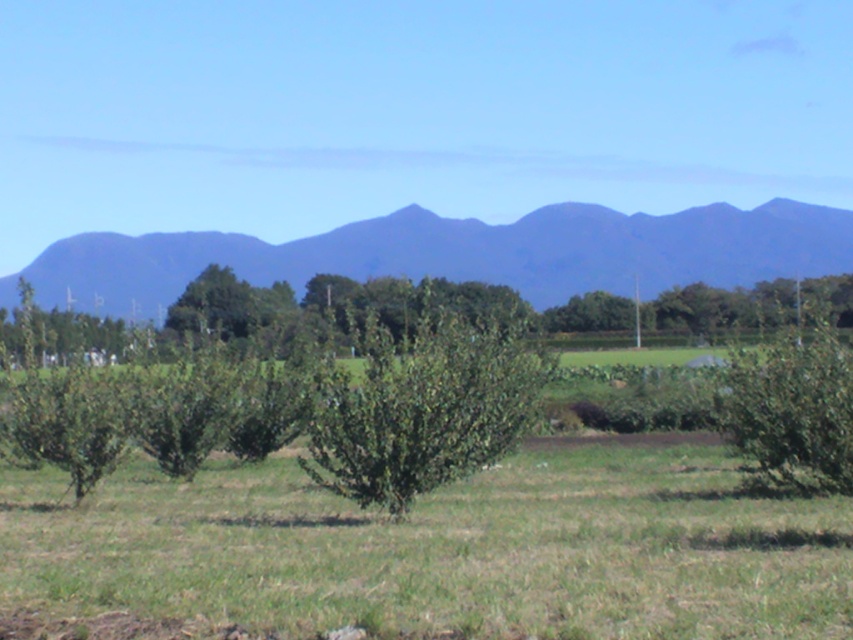
Question: Does blue matte mountain at upper center have a larger size compared to green leafy bush at center?

Choices:
 (A) no
 (B) yes

Answer: (B)

Question: Which of the following is the closest to the observer?

Choices:
 (A) green leafy bush at center
 (B) blue matte mountain at upper center

Answer: (A)

Question: Is blue matte mountain at upper center bigger than green leafy bush at center?

Choices:
 (A) yes
 (B) no

Answer: (A)

Question: Which of the following is the farthest from the observer?

Choices:
 (A) (537, 282)
 (B) (791, 468)

Answer: (A)

Question: Does blue matte mountain at upper center have a smaller size compared to green leafy bush at center?

Choices:
 (A) yes
 (B) no

Answer: (B)